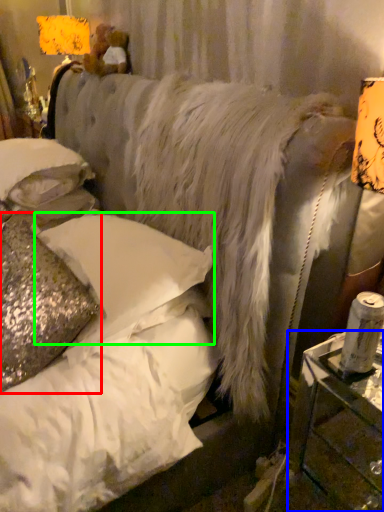
Question: Estimate the real-world distances between objects in this image. Which object is closer to pillow (highlighted by a red box), table (highlighted by a blue box) or pillow (highlighted by a green box)?

Choices:
 (A) table
 (B) pillow

Answer: (B)